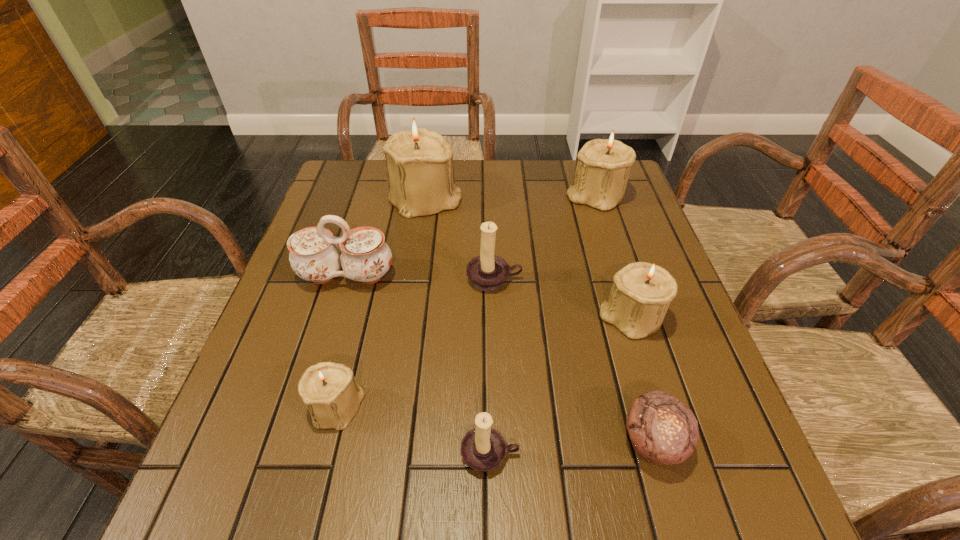
This screenshot has width=960, height=540. Identify the location of vacant position located on the wick of the nearest candle holder. (491, 524).

This screenshot has height=540, width=960. In order to click on free space located on the back of the shortest object in this screenshot , I will do tap(605, 275).

Where is `candle holder present at the near edge`? candle holder present at the near edge is located at coordinates (483, 448).

You are a GUI agent. You are given a task and a screenshot of the screen. Output one action in this format:
    pyautogui.click(x=<x>, y=<y>)
    Task: Click on the muffin situated at the near edge
    
    Given the screenshot: What is the action you would take?
    pyautogui.click(x=663, y=431)

You are a GUI agent. You are given a task and a screenshot of the screen. Output one action in this format:
    pyautogui.click(x=<x>, y=<y>)
    Task: Click on the chinaware located at the left edge
    The height and width of the screenshot is (540, 960).
    Given the screenshot: What is the action you would take?
    tap(314, 256)

I want to click on candle_holder at the left edge, so click(332, 395).

Identify the location of muffin that is at the right edge. This screenshot has width=960, height=540. (663, 431).

I want to click on object present at the far right corner, so click(603, 166).

Locate an element on the screen. This screenshot has width=960, height=540. object that is at the near right corner is located at coordinates (663, 431).

The height and width of the screenshot is (540, 960). Identify the location of blank space at the far edge of the desktop. (545, 172).